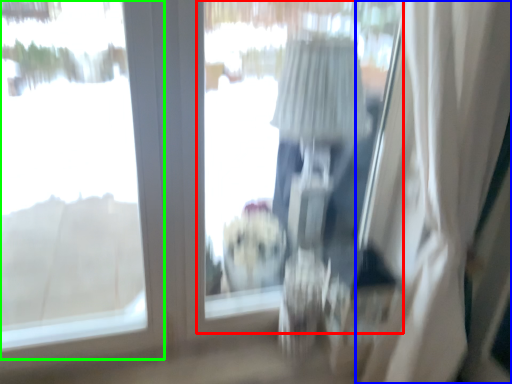
Question: Which is nearer to the window screen (highlighted by a red box)? curtain (highlighted by a blue box) or window (highlighted by a green box).

Choices:
 (A) curtain
 (B) window

Answer: (B)